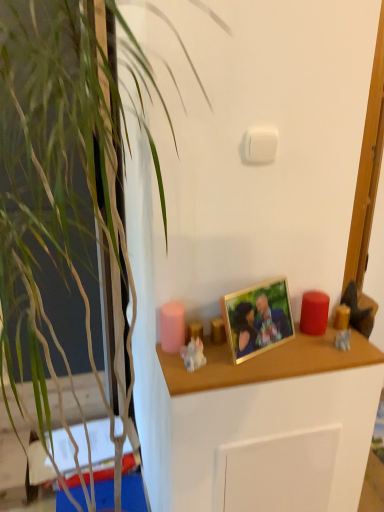
Find the location of `vacant area that lies between porcelain figurine at center, the 1th toy viewed from the left, and red matte candle at right, the 2th candle positioned from the right`. vacant area that lies between porcelain figurine at center, the 1th toy viewed from the left, and red matte candle at right, the 2th candle positioned from the right is located at coordinates (265, 346).